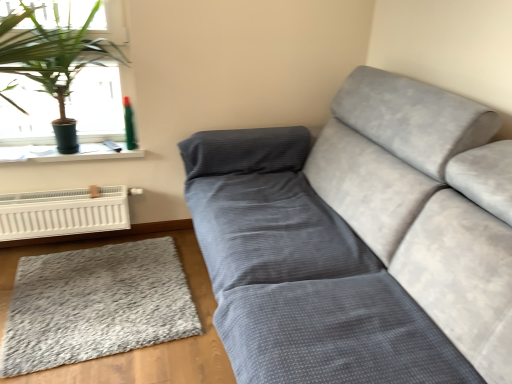
Question: From the image's perspective, relative to green leafy plant at upper left, is white plastic heater at lower left above or below?

Choices:
 (A) below
 (B) above

Answer: (A)

Question: Is white plastic heater at lower left in front of or behind green leafy plant at upper left in the image?

Choices:
 (A) front
 (B) behind

Answer: (B)

Question: Which object is positioned farthest from the white plastic window sill at upper left?

Choices:
 (A) gray shaggy rug at lower left
 (B) velvet gray couch at center
 (C) teal plastic spray can at upper left
 (D) green leafy plant at upper left
 (E) white plastic heater at lower left

Answer: (B)

Question: Which object is positioned closest to the velvet gray couch at center?

Choices:
 (A) gray shaggy rug at lower left
 (B) white plastic window sill at upper left
 (C) teal plastic spray can at upper left
 (D) white plastic heater at lower left
 (E) green leafy plant at upper left

Answer: (A)